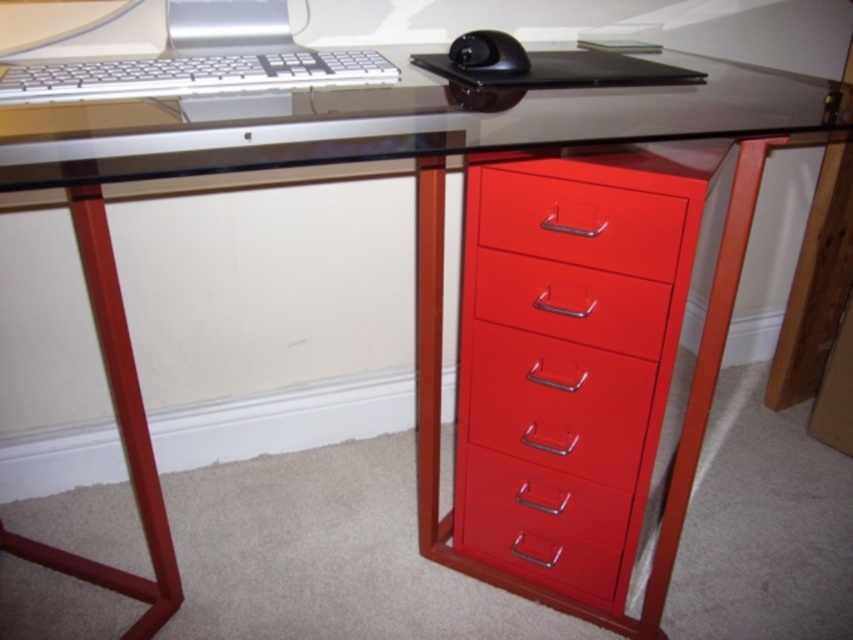
Question: Is glossy red drawer at center wider than black glossy mouse at upper center?

Choices:
 (A) no
 (B) yes

Answer: (B)

Question: Which of the following is the farthest from the observer?

Choices:
 (A) (636, 189)
 (B) (587, 292)
 (C) (277, 77)
 (D) (177, 40)

Answer: (D)

Question: Can you confirm if metallic red file cabinet at right is smaller than black glossy mouse at upper center?

Choices:
 (A) no
 (B) yes

Answer: (A)

Question: Estimate the real-world distances between objects in this image. Which object is closer to the glossy red drawer at center?

Choices:
 (A) black glossy mouse at upper center
 (B) silver metallic desktop computer at upper center

Answer: (A)

Question: Which point is closer to the camera?

Choices:
 (A) black glossy mouse at upper center
 (B) silver metallic desktop computer at upper center

Answer: (A)

Question: Does silver metallic keyboard at upper left have a smaller size compared to silver metallic desktop computer at upper center?

Choices:
 (A) no
 (B) yes

Answer: (A)